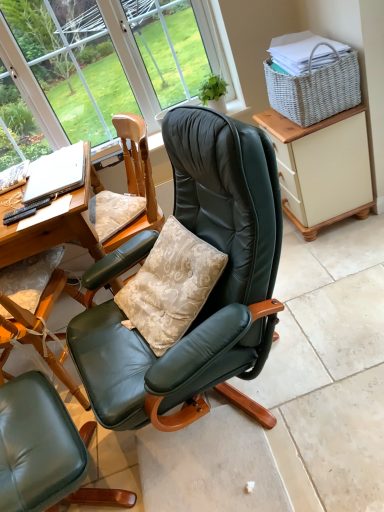
Find the location of `black plastic remote control at lower left`. black plastic remote control at lower left is located at coordinates point(25,211).

Describe the element at coordinates (44, 450) in the screenshot. I see `matte green leather chair at center` at that location.

Locate an element on the screen. black plastic remote control at lower left is located at coordinates (25, 211).

Is point (4, 224) closer or farther from the camera than point (30, 415)?

Clearly, point (4, 224) is more distant from the camera than point (30, 415).

From a real-world perspective, is black plastic remote control at lower left physically below matte green leather chair at center?

Incorrect, from a real-world perspective, black plastic remote control at lower left is higher than matte green leather chair at center.

Is matte green leather chair at center at the back of black plastic remote control at lower left?

No, matte green leather chair at center is not at the back of black plastic remote control at lower left.

From the image's perspective, would you say black plastic remote control at lower left is shown under matte green leather chair at center?

No, from the image's perspective, black plastic remote control at lower left is not beneath matte green leather chair at center.

Find the location of a particular element. cabinetry above the matte green leather chair at center (from a real-world perspective) is located at coordinates (321, 167).

What's the angular difference between matte green leather chair at center and beige painted cabinet at right's facing directions?

matte green leather chair at center and beige painted cabinet at right are facing 23.9 degrees away from each other.

Is matte green leather chair at center far away from beige painted cabinet at right?

That's right, there is a large distance between matte green leather chair at center and beige painted cabinet at right.

Between matte green leather chair at center and beige painted cabinet at right, which one appears on the right side from the viewer's perspective?

From the viewer's perspective, beige painted cabinet at right appears more on the right side.

From their relative heights in the image, would you say beige painted cabinet at right is taller or shorter than white woven picnic basket at upper right?

beige painted cabinet at right is taller than white woven picnic basket at upper right.

Considering the relative sizes of beige painted cabinet at right and white woven picnic basket at upper right in the image provided, is beige painted cabinet at right thinner than white woven picnic basket at upper right?

Incorrect, the width of beige painted cabinet at right is not less than that of white woven picnic basket at upper right.

Based on the photo, considering their positions, is beige painted cabinet at right located in front of or behind white woven picnic basket at upper right?

Visually, beige painted cabinet at right is located behind white woven picnic basket at upper right.

Based on the photo, from the image's perspective, is silver metallic laptop at left below matte green leather chair at center?

No.

Which is behind, point (59, 176) or point (3, 474)?

The point (59, 176) is farther from the camera.

Is silver metallic laptop at left looking in the opposite direction of matte green leather chair at center?

No, silver metallic laptop at left is not facing away from matte green leather chair at center.

Is silver metallic laptop at left to the left of matte green leather chair at center from the viewer's perspective?

Yes, silver metallic laptop at left is to the left of matte green leather chair at center.

Can you see matte green leather chair at center touching matte glass window at upper center?

matte green leather chair at center is not next to matte glass window at upper center, and they're not touching.

What's the angular difference between matte green leather chair at center and matte glass window at upper center's facing directions?

67.8 degrees.

Can you confirm if matte green leather chair at center is shorter than matte glass window at upper center?

Yes, matte green leather chair at center is shorter than matte glass window at upper center.

Can you confirm if beige painted cabinet at right is positioned to the left of matte green leather chair at center?

No.

Can you confirm if beige painted cabinet at right is shorter than matte green leather chair at center?

No, beige painted cabinet at right is not shorter than matte green leather chair at center.

Which of these two, beige painted cabinet at right or matte green leather chair at center, is wider?

matte green leather chair at center.

Which of these two, black plastic remote control at lower left or silver metallic laptop at left, is thinner?

With smaller width is black plastic remote control at lower left.

From the image's perspective, is black plastic remote control at lower left above silver metallic laptop at left?

Answer: No.

Is black plastic remote control at lower left bigger or smaller than silver metallic laptop at left?

Clearly, black plastic remote control at lower left is smaller in size than silver metallic laptop at left.

Between black plastic remote control at lower left and silver metallic laptop at left, which one appears on the left side from the viewer's perspective?

From the viewer's perspective, black plastic remote control at lower left appears more on the left side.

Where is `chair below the black plastic remote control at lower left (from a real-world perspective)`? Image resolution: width=384 pixels, height=512 pixels. chair below the black plastic remote control at lower left (from a real-world perspective) is located at coordinates (44, 450).

The width and height of the screenshot is (384, 512). Find the location of `chair lying in front of the beige painted cabinet at right`. chair lying in front of the beige painted cabinet at right is located at coordinates (44, 450).

From the image, which object appears to be farther from matte green leather chair at center, black plastic remote control at lower left or matte glass window at upper center?

Based on the image, matte glass window at upper center appears to be further to matte green leather chair at center.

Considering their positions, is silver metallic laptop at left positioned further to black plastic remote control at lower left than white woven picnic basket at upper right?

white woven picnic basket at upper right lies further to black plastic remote control at lower left than the other object.

Based on their spatial positions, is silver metallic laptop at left or beige painted cabinet at right further from matte glass window at upper center?

Among the two, beige painted cabinet at right is located further to matte glass window at upper center.

Based on their spatial positions, is white woven picnic basket at upper right or matte green leather chair at center closer to beige painted cabinet at right?

white woven picnic basket at upper right is positioned closer to the anchor beige painted cabinet at right.

Which object lies nearer to the anchor point white woven picnic basket at upper right, beige painted cabinet at right or matte green leather chair at center?

Based on the image, beige painted cabinet at right appears to be nearer to white woven picnic basket at upper right.

Looking at the image, which one is located further to matte glass window at upper center, silver metallic laptop at left or white woven picnic basket at upper right?

white woven picnic basket at upper right lies further to matte glass window at upper center than the other object.

Considering their positions, is matte glass window at upper center positioned further to beige painted cabinet at right than black plastic remote control at lower left?

Based on the image, black plastic remote control at lower left appears to be further to beige painted cabinet at right.

Looking at the image, which one is located further to silver metallic laptop at left, beige painted cabinet at right or black plastic remote control at lower left?

The object further to silver metallic laptop at left is beige painted cabinet at right.

Where is `bay window situated between black plastic remote control at lower left and white woven picnic basket at upper right from left to right`? The width and height of the screenshot is (384, 512). bay window situated between black plastic remote control at lower left and white woven picnic basket at upper right from left to right is located at coordinates (114, 64).

Where is `bay window between black plastic remote control at lower left and beige painted cabinet at right`? This screenshot has height=512, width=384. bay window between black plastic remote control at lower left and beige painted cabinet at right is located at coordinates (114, 64).

The width and height of the screenshot is (384, 512). I want to click on laptop between matte glass window at upper center and matte green leather chair at center vertically, so click(x=56, y=174).

Locate an element on the screen. The image size is (384, 512). laptop between matte glass window at upper center and black plastic remote control at lower left in the up-down direction is located at coordinates (56, 174).